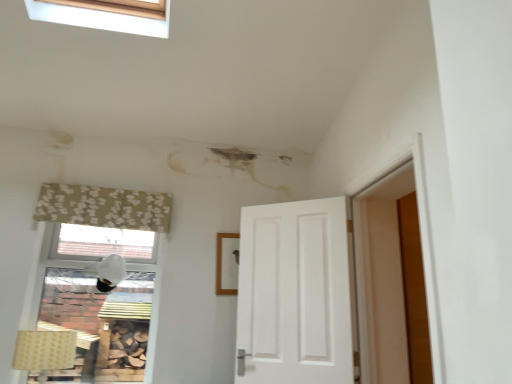
Question: Is beige floral fabric curtain at upper left positioned beyond the bounds of white matte lampshade at upper left, which is the first lamp from back to front?

Choices:
 (A) no
 (B) yes

Answer: (B)

Question: Does beige floral fabric curtain at upper left have a smaller size compared to white matte lampshade at upper left, the 2th lamp from the bottom?

Choices:
 (A) no
 (B) yes

Answer: (A)

Question: Is the position of beige floral fabric curtain at upper left more distant than that of white matte lampshade at upper left, positioned as the 2th lamp in left-to-right order?

Choices:
 (A) no
 (B) yes

Answer: (A)

Question: Does beige floral fabric curtain at upper left turn towards white matte lampshade at upper left, which is the second lamp from front to back?

Choices:
 (A) yes
 (B) no

Answer: (B)

Question: From a real-world perspective, is beige floral fabric curtain at upper left located higher than white matte lampshade at upper left, which is the second lamp from front to back?

Choices:
 (A) no
 (B) yes

Answer: (B)

Question: Which is correct: white matte lampshade at upper left, the 2th lamp from the bottom, is inside yellow fabric lampshade at lower left, which ranks as the 2th lamp in top-to-bottom order, or outside of it?

Choices:
 (A) outside
 (B) inside

Answer: (A)

Question: Relative to yellow fabric lampshade at lower left, which is counted as the first lamp, starting from the left, is white matte lampshade at upper left, positioned as the 2th lamp in left-to-right order, in front or behind?

Choices:
 (A) behind
 (B) front

Answer: (A)

Question: Considering the positions of white matte lampshade at upper left, the first lamp in the top-to-bottom sequence, and yellow fabric lampshade at lower left, marked as the 2th lamp in a back-to-front arrangement, in the image, is white matte lampshade at upper left, the first lamp in the top-to-bottom sequence, taller or shorter than yellow fabric lampshade at lower left, marked as the 2th lamp in a back-to-front arrangement,?

Choices:
 (A) short
 (B) tall

Answer: (A)

Question: From the image's perspective, relative to yellow fabric lampshade at lower left, which ranks as the 2th lamp in top-to-bottom order, is white matte lampshade at upper left, the 2th lamp from the bottom, above or below?

Choices:
 (A) below
 (B) above

Answer: (B)

Question: Visually, is beige floral fabric curtain at upper left positioned to the left or to the right of white matte lampshade at upper left, positioned as the 2th lamp in left-to-right order?

Choices:
 (A) left
 (B) right

Answer: (A)

Question: Is beige floral fabric curtain at upper left in front of or behind white matte lampshade at upper left, positioned as the 2th lamp in left-to-right order, in the image?

Choices:
 (A) front
 (B) behind

Answer: (A)

Question: Is point (67, 221) closer or farther from the camera than point (106, 284)?

Choices:
 (A) closer
 (B) farther

Answer: (B)

Question: Is beige floral fabric curtain at upper left bigger or smaller than white matte lampshade at upper left, which is the first lamp from back to front?

Choices:
 (A) big
 (B) small

Answer: (A)

Question: From the image's perspective, relative to beige floral fabric curtain at upper left, is yellow fabric lampshade at lower left, marked as the 2th lamp in a back-to-front arrangement, above or below?

Choices:
 (A) above
 (B) below

Answer: (B)

Question: In terms of size, does yellow fabric lampshade at lower left, which is the 1th lamp in bottom-to-top order, appear bigger or smaller than beige floral fabric curtain at upper left?

Choices:
 (A) big
 (B) small

Answer: (A)